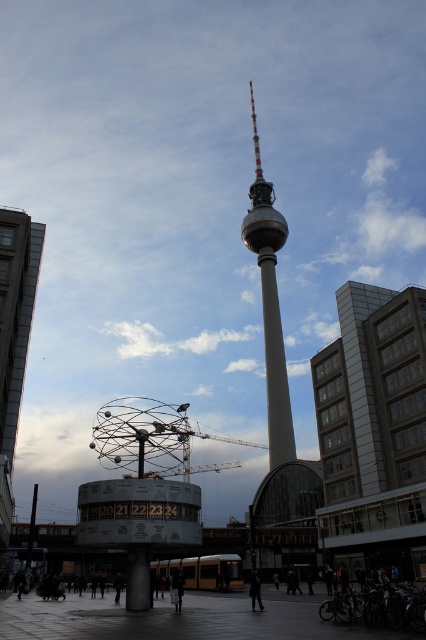
Question: Does smooth gray tower at center appear over dark gray pants at center?

Choices:
 (A) yes
 (B) no

Answer: (A)

Question: Which object appears farthest from the camera in this image?

Choices:
 (A) metallic pole at lower left
 (B) smooth gray tower at center
 (C) dark gray pants at center
 (D) black coat at lower center

Answer: (B)

Question: Is metallic pole at lower left to the right of black coat at lower center from the viewer's perspective?

Choices:
 (A) yes
 (B) no

Answer: (B)

Question: Is metallic pole at lower left in front of black coat at lower center?

Choices:
 (A) no
 (B) yes

Answer: (A)

Question: Which of the following is the farthest from the observer?

Choices:
 (A) dark gray pants at center
 (B) metallic pole at lower left

Answer: (B)

Question: Among these objects, which one is farthest from the camera?

Choices:
 (A) gray concrete building at right
 (B) metallic silver clock tower at left
 (C) smooth gray tower at center

Answer: (C)